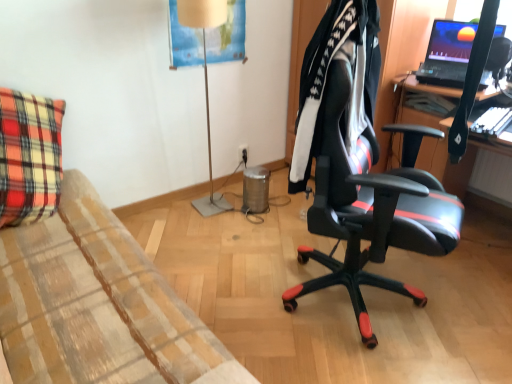
Question: Is matte black laptop at upper right located within black leather jacket at center?

Choices:
 (A) no
 (B) yes

Answer: (A)

Question: From a real-world perspective, is black leather jacket at center physically above matte black laptop at upper right?

Choices:
 (A) yes
 (B) no

Answer: (B)

Question: Can you confirm if black leather jacket at center is positioned to the right of matte black laptop at upper right?

Choices:
 (A) no
 (B) yes

Answer: (A)

Question: Is black leather jacket at center not within matte black laptop at upper right?

Choices:
 (A) no
 (B) yes

Answer: (B)

Question: Is black leather jacket at center not near matte black laptop at upper right?

Choices:
 (A) yes
 (B) no

Answer: (B)

Question: Can you confirm if black leather jacket at center is wider than matte black laptop at upper right?

Choices:
 (A) no
 (B) yes

Answer: (A)

Question: Is the position of black plastic power outlet at center less distant than that of matte beige lamp at center?

Choices:
 (A) no
 (B) yes

Answer: (A)

Question: Is matte beige lamp at center located within black plastic power outlet at center?

Choices:
 (A) no
 (B) yes

Answer: (A)

Question: Is black plastic power outlet at center facing away from matte beige lamp at center?

Choices:
 (A) no
 (B) yes

Answer: (A)

Question: Does black plastic power outlet at center appear on the right side of matte beige lamp at center?

Choices:
 (A) yes
 (B) no

Answer: (A)

Question: Does black plastic power outlet at center come behind matte beige lamp at center?

Choices:
 (A) yes
 (B) no

Answer: (A)

Question: From the image's perspective, is black plastic power outlet at center beneath matte beige lamp at center?

Choices:
 (A) yes
 (B) no

Answer: (A)

Question: Is black plastic power outlet at center beside black leather office chair at center?

Choices:
 (A) no
 (B) yes

Answer: (A)